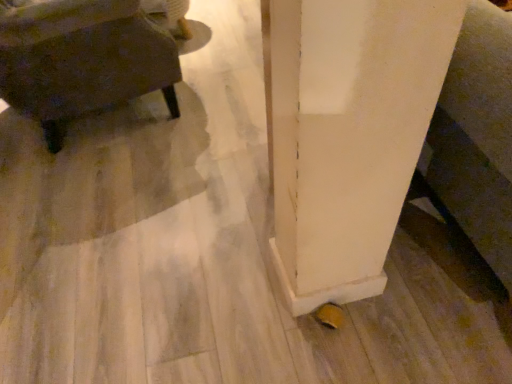
Question: From the image's perspective, is matte dark brown coffee table at left located above or below white matte pillar at lower right?

Choices:
 (A) below
 (B) above

Answer: (B)

Question: In terms of width, does matte dark brown coffee table at left look wider or thinner when compared to white matte pillar at lower right?

Choices:
 (A) thin
 (B) wide

Answer: (A)

Question: In the image, is matte dark brown coffee table at left on the left side or the right side of white matte pillar at lower right?

Choices:
 (A) right
 (B) left

Answer: (B)

Question: Is white matte pillar at lower right bigger or smaller than matte dark brown coffee table at left?

Choices:
 (A) small
 (B) big

Answer: (B)

Question: Is white matte pillar at lower right taller or shorter than matte dark brown coffee table at left?

Choices:
 (A) short
 (B) tall

Answer: (B)

Question: From the image's perspective, is white matte pillar at lower right above or below matte dark brown coffee table at left?

Choices:
 (A) below
 (B) above

Answer: (A)

Question: Would you say white matte pillar at lower right is inside or outside matte dark brown coffee table at left?

Choices:
 (A) inside
 (B) outside

Answer: (B)